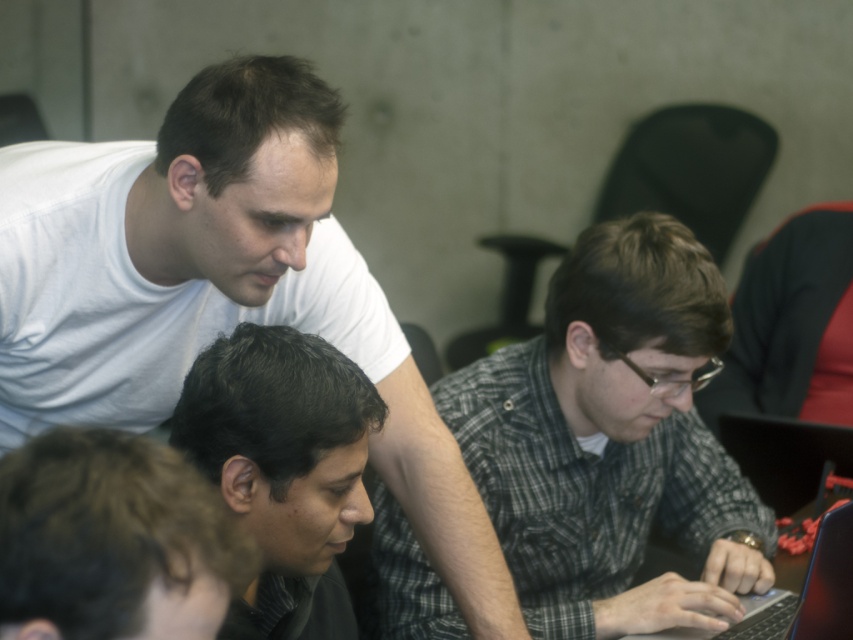
Between point (213, 392) and point (840, 524), which one is positioned in front?

Point (213, 392)

Does dark gray checkered shirt at lower center come behind black glossy laptop at lower right?

No, it is in front of black glossy laptop at lower right.

Does point (323, 426) lie in front of point (811, 625)?

Yes, point (323, 426) is closer to viewer.

Where is `dark gray checkered shirt at lower center`? Image resolution: width=853 pixels, height=640 pixels. dark gray checkered shirt at lower center is located at coordinates (283, 467).

Who is positioned more to the left, checkered fabric shirt at center or dark brown hair at lower left?

Positioned to the left is dark brown hair at lower left.

Is checkered fabric shirt at center bigger than dark brown hair at lower left?

Yes, checkered fabric shirt at center is bigger than dark brown hair at lower left.

Measure the distance between point (x=418, y=602) and camera.

They are 1.74 meters apart.

Find the location of a particular element. checkered fabric shirt at center is located at coordinates (611, 438).

Is checkered fabric shirt at center to the right of black glossy laptop at lower right from the viewer's perspective?

No, checkered fabric shirt at center is not to the right of black glossy laptop at lower right.

Which of these two, checkered fabric shirt at center or black glossy laptop at lower right, stands shorter?

black glossy laptop at lower right is shorter.

Who is more distant from viewer, (635, 630) or (850, 588)?

Positioned behind is point (635, 630).

Where is `checkered fabric shirt at center`? The image size is (853, 640). checkered fabric shirt at center is located at coordinates (611, 438).